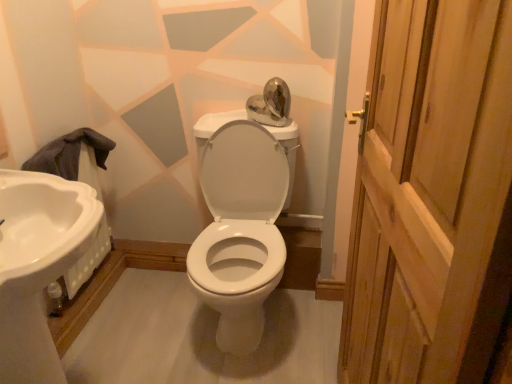
Question: Does white glossy sink at left turn towards white glossy porcelain at center?

Choices:
 (A) yes
 (B) no

Answer: (B)

Question: Is white glossy sink at left bigger than white glossy porcelain at center?

Choices:
 (A) yes
 (B) no

Answer: (B)

Question: Does white glossy sink at left touch white glossy porcelain at center?

Choices:
 (A) yes
 (B) no

Answer: (B)

Question: Is white glossy sink at left not near white glossy porcelain at center?

Choices:
 (A) yes
 (B) no

Answer: (B)

Question: Does white glossy sink at left appear on the left side of white glossy porcelain at center?

Choices:
 (A) no
 (B) yes

Answer: (B)

Question: Visually, is wooden door at right positioned to the left or to the right of white glossy porcelain at center?

Choices:
 (A) right
 (B) left

Answer: (A)

Question: From a real-world perspective, is wooden door at right above or below white glossy porcelain at center?

Choices:
 (A) below
 (B) above

Answer: (B)

Question: From the image's perspective, is wooden door at right above or below white glossy porcelain at center?

Choices:
 (A) below
 (B) above

Answer: (A)

Question: In terms of width, does wooden door at right look wider or thinner when compared to white glossy porcelain at center?

Choices:
 (A) wide
 (B) thin

Answer: (B)

Question: Is white glossy porcelain at center in front of or behind white glossy sink at left in the image?

Choices:
 (A) behind
 (B) front

Answer: (A)

Question: Is white glossy porcelain at center inside or outside of white glossy sink at left?

Choices:
 (A) outside
 (B) inside

Answer: (A)

Question: Is white glossy porcelain at center to the left or to the right of white glossy sink at left in the image?

Choices:
 (A) left
 (B) right

Answer: (B)

Question: From a real-world perspective, is white glossy porcelain at center physically located above or below white glossy sink at left?

Choices:
 (A) below
 (B) above

Answer: (A)

Question: Based on their positions, is white glossy sink at left located to the left or right of white glossy porcelain at center?

Choices:
 (A) right
 (B) left

Answer: (B)

Question: From the image's perspective, is white glossy sink at left located above or below white glossy porcelain at center?

Choices:
 (A) above
 (B) below

Answer: (B)